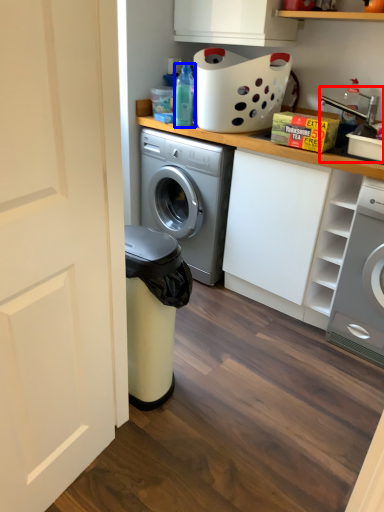
Question: Among these objects, which one is nearest to the camera, sink (highlighted by a red box) or bottle (highlighted by a blue box)?

Choices:
 (A) sink
 (B) bottle

Answer: (A)